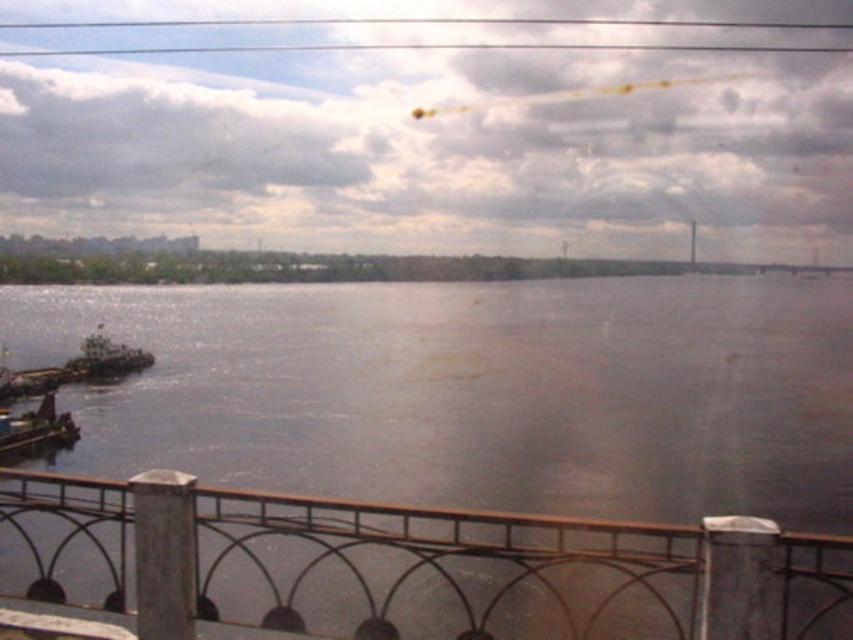
Does dark brown water at center have a greater width compared to white matte boat at left?

Indeed, dark brown water at center has a greater width compared to white matte boat at left.

In the scene shown: Is dark brown water at center further to camera compared to white matte boat at left?

That is False.

Where is `dark brown water at center`? This screenshot has width=853, height=640. dark brown water at center is located at coordinates (477, 390).

Where is `dark brown water at center`? The width and height of the screenshot is (853, 640). dark brown water at center is located at coordinates (477, 390).

Can you confirm if wooden boat at lower left is taller than white matte boat at left?

No, wooden boat at lower left is not taller than white matte boat at left.

Who is positioned more to the left, wooden boat at lower left or white matte boat at left?

From the viewer's perspective, wooden boat at lower left appears more on the left side.

What do you see at coordinates (35, 432) in the screenshot? I see `wooden boat at lower left` at bounding box center [35, 432].

Identify the location of wooden boat at lower left. The width and height of the screenshot is (853, 640). (35, 432).

Between dark brown water at center and metallic gray railing at lower center, which one is positioned higher?

Positioned higher is dark brown water at center.

Is dark brown water at center bigger than metallic gray railing at lower center?

Yes.

Between point (177, 360) and point (643, 577), which one is positioned in front?

Positioned in front is point (643, 577).

Identify the location of dark brown water at center. The image size is (853, 640). (477, 390).